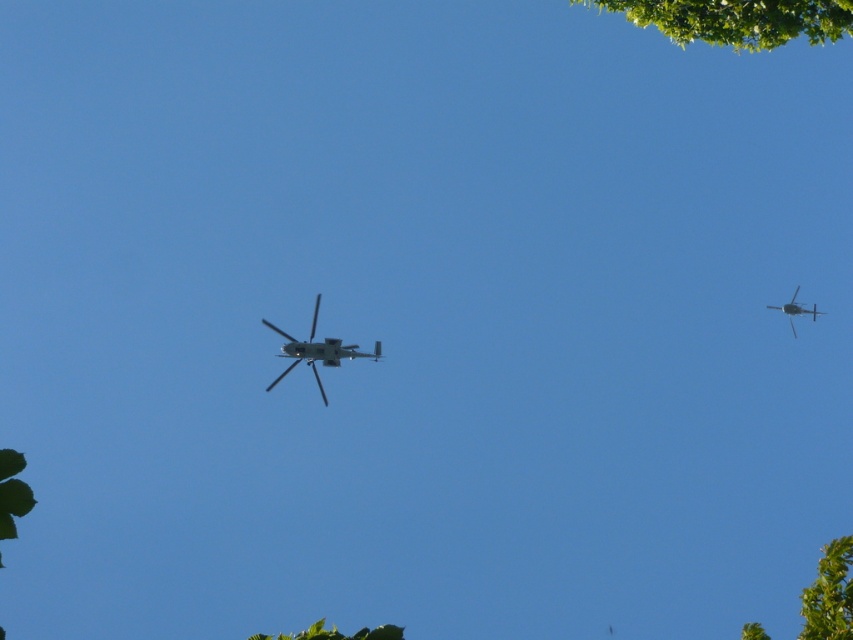
Question: In this image, where is green leafy tree at upper right located relative to metallic gray helicopter at center?

Choices:
 (A) below
 (B) above

Answer: (B)

Question: Does metallic gray helicopter at center have a larger size compared to metallic gray helicopter at right?

Choices:
 (A) yes
 (B) no

Answer: (A)

Question: Does green leafy tree at lower right have a larger size compared to green leafy tree at lower center?

Choices:
 (A) yes
 (B) no

Answer: (B)

Question: Which point is closer to the camera?

Choices:
 (A) (318, 627)
 (B) (668, 8)
 (C) (802, 308)
 (D) (280, 333)

Answer: (A)

Question: Estimate the real-world distances between objects in this image. Which object is closer to the metallic gray helicopter at center?

Choices:
 (A) green leafy tree at lower center
 (B) green leafy tree at lower right

Answer: (A)

Question: Based on their relative distances, which object is farther from the green leafy tree at lower center?

Choices:
 (A) green leafy tree at lower right
 (B) metallic gray helicopter at center
 (C) metallic gray helicopter at right

Answer: (C)